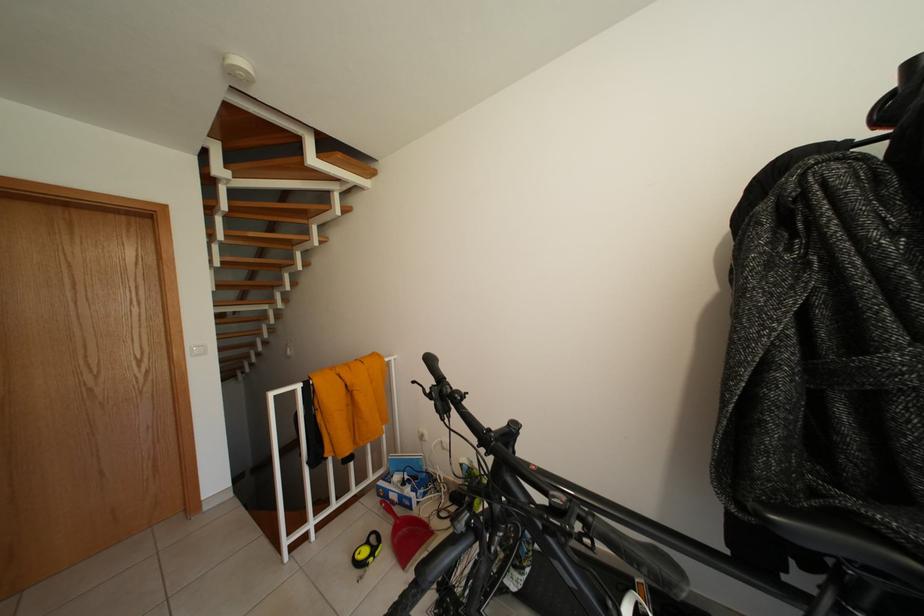
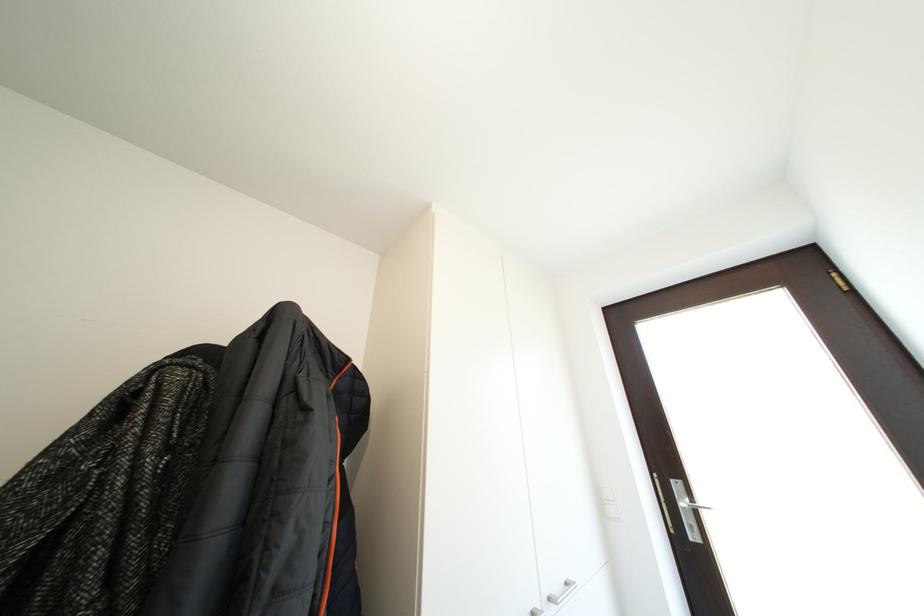
The first image is from the beginning of the video and the second image is from the end. How did the camera likely rotate when shooting the video?

The camera rotated toward right-up.